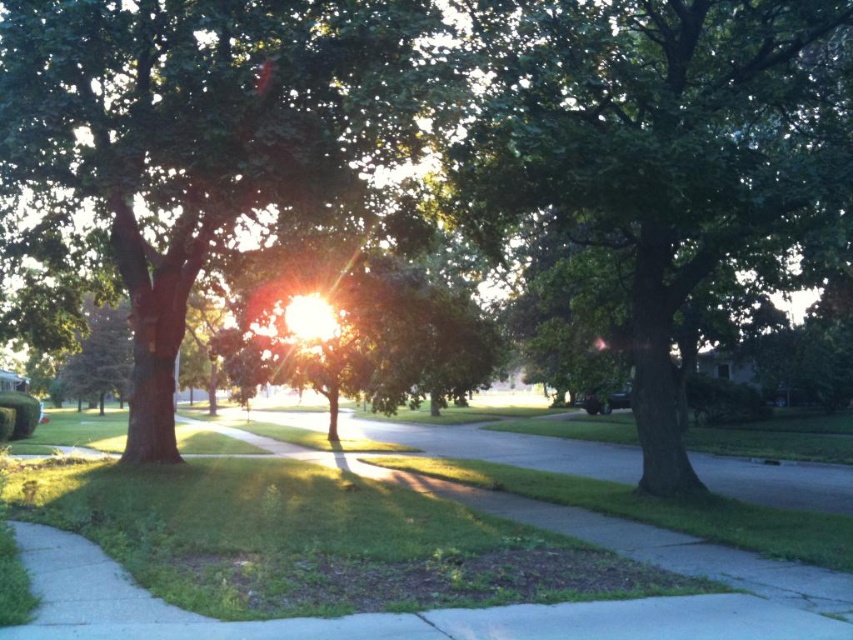
Question: Observing the image, what is the correct spatial positioning of green leafy tree at center in reference to green matte tree at center?

Choices:
 (A) above
 (B) below

Answer: (B)

Question: Does green matte tree at center appear on the left side of shiny black car at center?

Choices:
 (A) no
 (B) yes

Answer: (B)

Question: Considering the real-world distances, which object is farthest from the shiny black car at center?

Choices:
 (A) green matte tree at center
 (B) green leafy tree at center
 (C) smooth concrete pavement at center

Answer: (A)

Question: Is the position of green leafy tree at center less distant than that of smooth concrete pavement at center?

Choices:
 (A) no
 (B) yes

Answer: (A)

Question: Estimate the real-world distances between objects in this image. Which object is farther from the shiny black car at center?

Choices:
 (A) smooth concrete pavement at center
 (B) green matte tree at center

Answer: (B)

Question: Estimate the real-world distances between objects in this image. Which object is closer to the green leafy tree at center?

Choices:
 (A) green matte tree at center
 (B) shiny black car at center

Answer: (A)